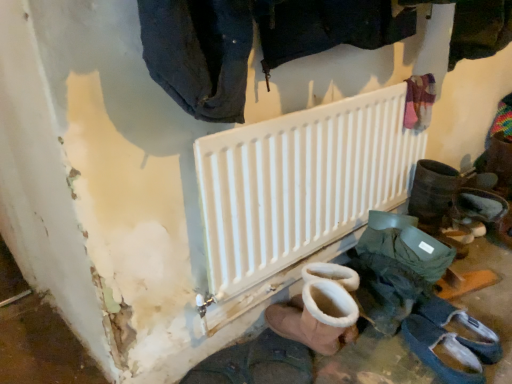
Question: Which direction should I rotate to face dark brown leather boot at lower center, which appears as the 5th footwear when viewed from the right, — up or down?

Choices:
 (A) up
 (B) down

Answer: (B)

Question: Is dark gray suede boot at lower right, which is counted as the 2th footwear, starting from the right, at the back of dark brown leather boot at lower center, the first footwear in the left-to-right sequence?

Choices:
 (A) yes
 (B) no

Answer: (B)

Question: Is dark brown leather boot at lower center, which appears as the 5th footwear when viewed from the right, completely or partially outside of dark gray suede boot at lower right, which is counted as the 2th footwear, starting from the right?

Choices:
 (A) yes
 (B) no

Answer: (A)

Question: Considering the relative sizes of dark brown leather boot at lower center, which appears as the 5th footwear when viewed from the right, and dark gray suede boot at lower right, which is counted as the 2th footwear, starting from the right, in the image provided, is dark brown leather boot at lower center, which appears as the 5th footwear when viewed from the right, thinner than dark gray suede boot at lower right, which is counted as the 2th footwear, starting from the right,?

Choices:
 (A) yes
 (B) no

Answer: (B)

Question: Are dark brown leather boot at lower center, which appears as the 5th footwear when viewed from the right, and dark gray suede boot at lower right, which ranks as the fourth footwear in left-to-right order, located far from each other?

Choices:
 (A) yes
 (B) no

Answer: (B)

Question: Is dark brown leather boot at lower center, the first footwear in the left-to-right sequence, to the left of dark gray suede boot at lower right, which is counted as the 2th footwear, starting from the right, from the viewer's perspective?

Choices:
 (A) yes
 (B) no

Answer: (A)

Question: Considering the relative sizes of dark brown leather boot at lower center, the first footwear in the left-to-right sequence, and dark gray suede boot at lower right, which is counted as the 2th footwear, starting from the right, in the image provided, is dark brown leather boot at lower center, the first footwear in the left-to-right sequence, shorter than dark gray suede boot at lower right, which is counted as the 2th footwear, starting from the right,?

Choices:
 (A) no
 (B) yes

Answer: (B)

Question: Does white suede boot at lower center, which ranks as the 3th footwear in right-to-left order, have a larger size compared to dark brown leather boot at lower center, the first footwear in the left-to-right sequence?

Choices:
 (A) yes
 (B) no

Answer: (A)

Question: From the image's perspective, does white suede boot at lower center, the 3th footwear viewed from the left, appear lower than dark brown leather boot at lower center, the first footwear in the left-to-right sequence?

Choices:
 (A) no
 (B) yes

Answer: (A)

Question: Is white suede boot at lower center, the 3th footwear viewed from the left, completely or partially outside of dark brown leather boot at lower center, the first footwear in the left-to-right sequence?

Choices:
 (A) yes
 (B) no

Answer: (A)

Question: Is white suede boot at lower center, which ranks as the 3th footwear in right-to-left order, far from dark brown leather boot at lower center, which appears as the 5th footwear when viewed from the right?

Choices:
 (A) yes
 (B) no

Answer: (B)

Question: Is white suede boot at lower center, which ranks as the 3th footwear in right-to-left order, positioned before dark brown leather boot at lower center, which appears as the 5th footwear when viewed from the right?

Choices:
 (A) yes
 (B) no

Answer: (B)

Question: Is white suede boot at lower center, which ranks as the 3th footwear in right-to-left order, oriented towards dark brown leather boot at lower center, which appears as the 5th footwear when viewed from the right?

Choices:
 (A) yes
 (B) no

Answer: (B)

Question: Does dark blue denim jeans at upper center lie in front of white matte radiator at center?

Choices:
 (A) no
 (B) yes

Answer: (B)